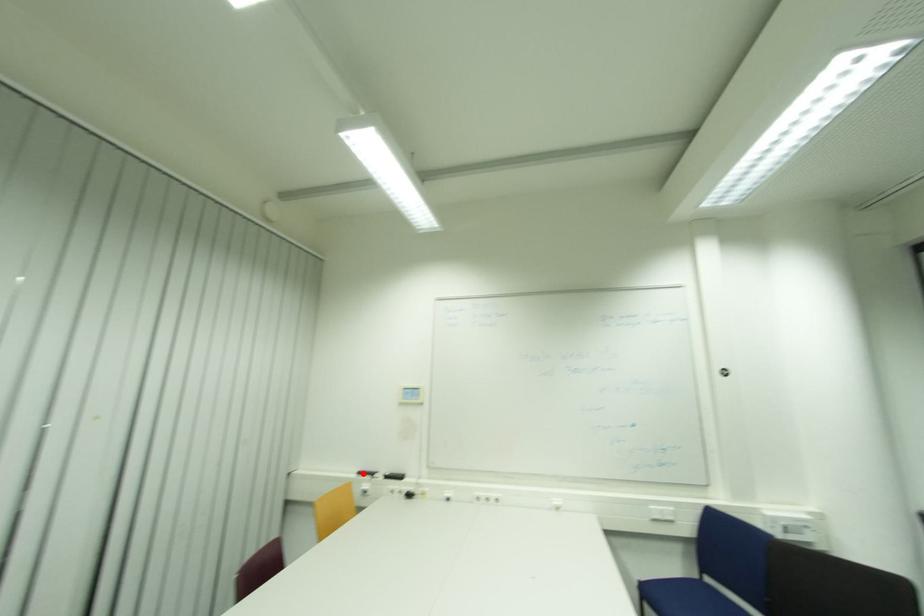
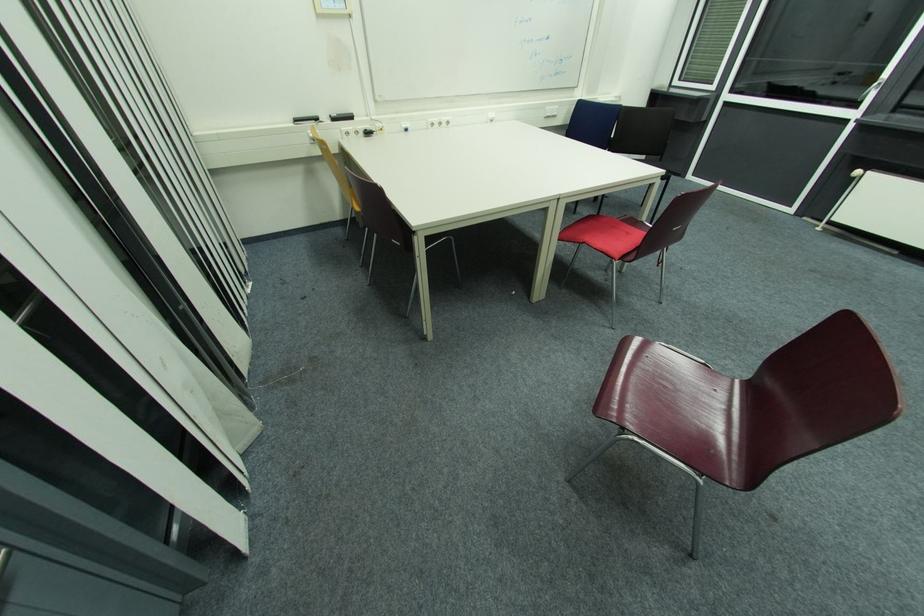
Question: I am providing you with two images of the same scene from different viewpoints. A red point is shown in image1. For the corresponding object point in image2, is it positioned nearer or farther from the camera?

Choices:
 (A) Nearer
 (B) Farther

Answer: (A)